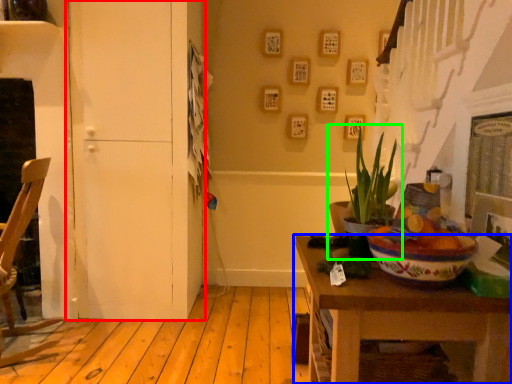
Question: Considering the real-world distances, which object is farthest from door (highlighted by a red box)? table (highlighted by a blue box) or houseplant (highlighted by a green box)?

Choices:
 (A) table
 (B) houseplant

Answer: (A)